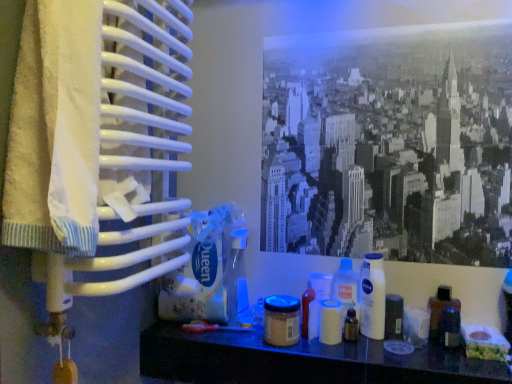
You are a GUI agent. You are given a task and a screenshot of the screen. Output one action in this format:
    pyautogui.click(x=<x>, y=<y>)
    Task: Click on the free space to the left of translucent plastic bottle at lower center, arranged as the 6th toiletry when viewed from the left
    
    Given the screenshot: What is the action you would take?
    pyautogui.click(x=281, y=342)